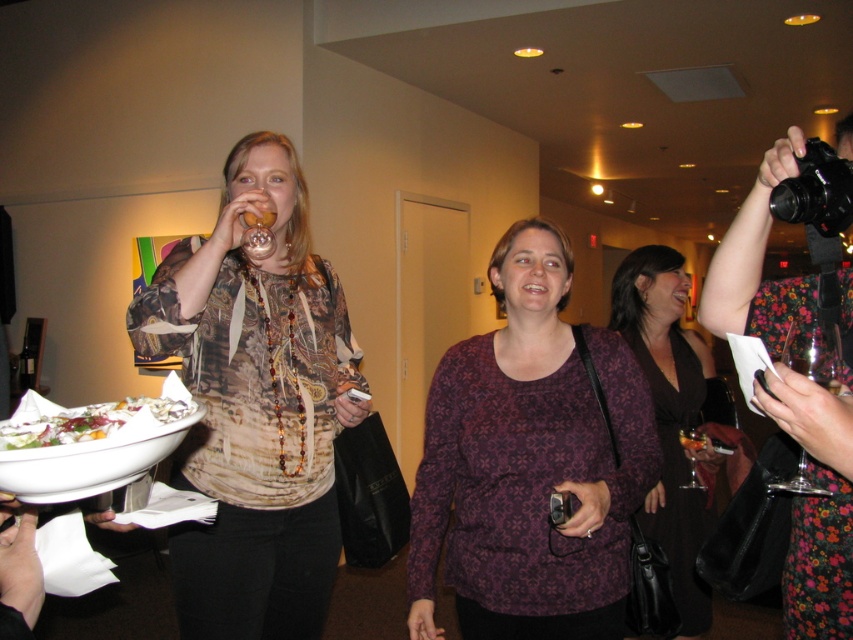
You are at a social event and see two people in the foreground. One is wearing a printed silk blouse at left, and the other is wearing a purple printed shirt at center. Which person is positioned more to the left?

The printed silk blouse at left is positioned more to the left than the purple printed shirt at center.

You are standing at the point labeled point (746, 232) in the image. You want to move to the nearest exit, which is located 10 feet away from your current position. Can you safely walk straight ahead without encountering any obstacles?

The distance between point (746, 232) and the viewer is 3.92 feet, but the nearest exit is 10 feet away. Since the exit is further than the distance from the point to the viewer, you can safely walk straight ahead as there are no obstacles mentioned in the provided description.